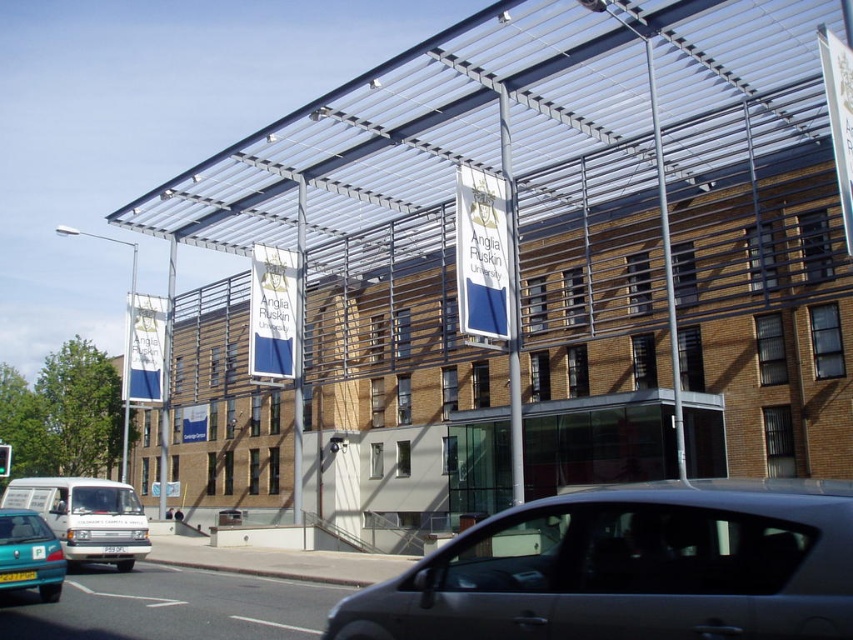
In the scene shown: You are a delivery person arriving at Anglia Ruskin University. You need to park your vehicle, which is the silver metallic car at center, but there is a white matte van at lower left blocking the entrance. Can you drive forward to get past the van?

The silver metallic car at center is in front of the white matte van at lower left, meaning the van is behind the car. Therefore, you can drive forward to move past the van.

You are a delivery person needing to park your truck, which is 2 meters wide, in the parking lot near the silver metallic car at center and the white matte van at lower left. Based on their widths, can you determine if the parking space between them is wide enough for your truck?

→ The silver metallic car at center is thinner than the white matte van at lower left. However, without knowing the exact width of either vehicle, it is impossible to determine if the parking space between them is wide enough for a truck that is 2 meters wide.

You are a delivery person trying to park your truck next to the white matte van at lower left and the teal matte hatchback at lower left. Based on the scene, which vehicle should you park next to if you need more space for your truck?

The white matte van at lower left might be wider than teal matte hatchback at lower left, so you should park next to the teal matte hatchback at lower left to have more space available.